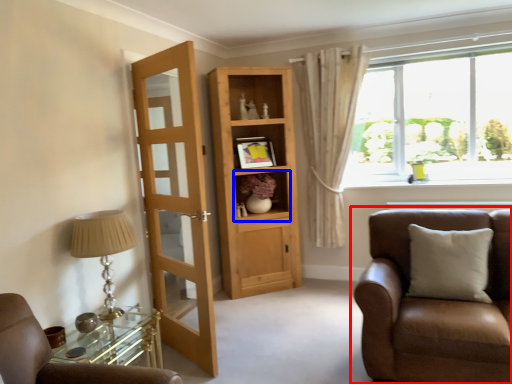
Question: Which object is further to the camera taking this photo, chair (highlighted by a red box) or cabinet (highlighted by a blue box)?

Choices:
 (A) chair
 (B) cabinet

Answer: (B)